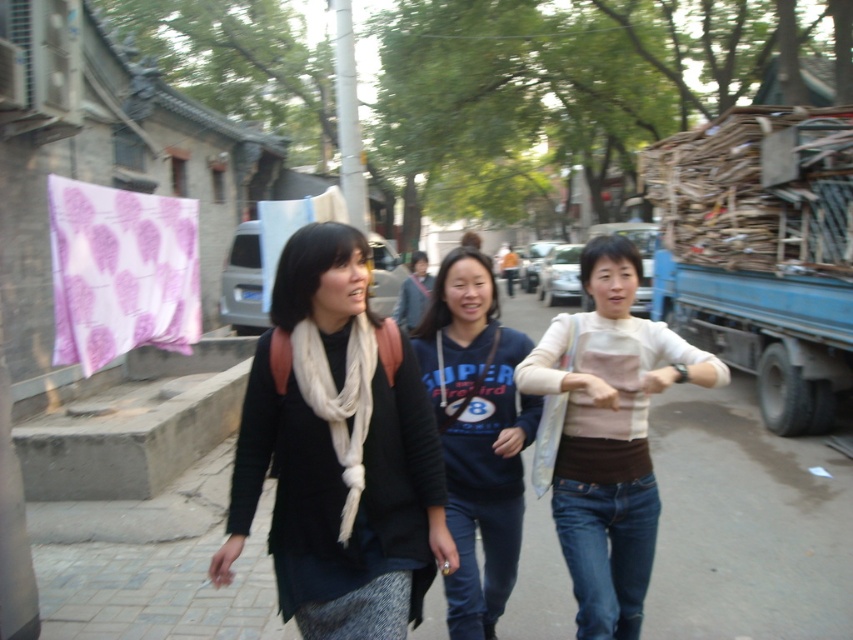
Does matte black scarf at center have a larger size compared to white knit sweater at center?

Incorrect, matte black scarf at center is not larger than white knit sweater at center.

Based on the photo, is matte black scarf at center wider than white knit sweater at center?

Yes, matte black scarf at center is wider than white knit sweater at center.

Describe the element at coordinates (339, 452) in the screenshot. Image resolution: width=853 pixels, height=640 pixels. I see `matte black scarf at center` at that location.

Find the location of a particular element. matte black scarf at center is located at coordinates (339, 452).

Between matte black scarf at center and purple fabric at left, which one appears on the right side from the viewer's perspective?

matte black scarf at center

Which is behind, point (407, 531) or point (137, 278)?

Positioned behind is point (137, 278).

Where is `matte black scarf at center`? This screenshot has width=853, height=640. matte black scarf at center is located at coordinates (339, 452).

Is blue cotton hoodie at center thinner than white fabric at center?

In fact, blue cotton hoodie at center might be wider than white fabric at center.

Can you confirm if blue cotton hoodie at center is taller than white fabric at center?

Yes.

Is point (454, 300) less distant than point (262, 273)?

Yes, point (454, 300) is closer to viewer.

You are a GUI agent. You are given a task and a screenshot of the screen. Output one action in this format:
    pyautogui.click(x=<x>, y=<y>)
    Task: Click on the blue cotton hoodie at center
    The image size is (853, 640).
    Given the screenshot: What is the action you would take?
    pyautogui.click(x=476, y=433)